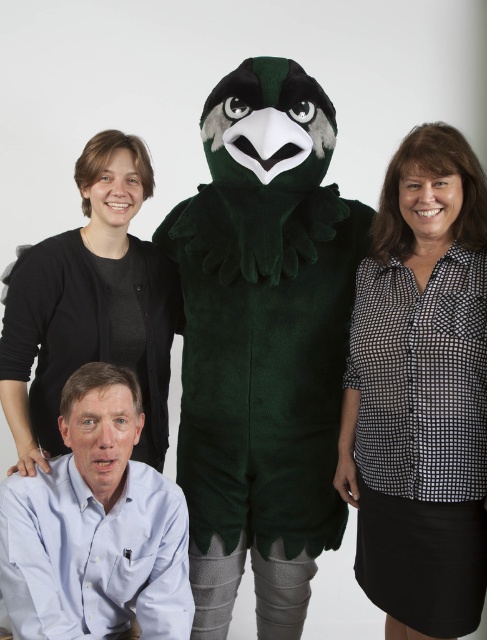
Question: From the image, what is the correct spatial relationship of black checkered shirt at right in relation to light blue shirt at lower left?

Choices:
 (A) right
 (B) left

Answer: (A)

Question: Which of the following is the farthest from the observer?

Choices:
 (A) black soft sweater at upper left
 (B) light blue shirt at lower left

Answer: (A)

Question: Where is black checkered shirt at right located in relation to black soft sweater at upper left in the image?

Choices:
 (A) right
 (B) left

Answer: (A)

Question: Estimate the real-world distances between objects in this image. Which object is closer to the light blue shirt at lower left?

Choices:
 (A) black checkered shirt at right
 (B) black soft sweater at upper left

Answer: (B)

Question: Considering the relative positions of black checkered shirt at right and black soft sweater at upper left in the image provided, where is black checkered shirt at right located with respect to black soft sweater at upper left?

Choices:
 (A) above
 (B) below

Answer: (B)

Question: Which object appears closest to the camera in this image?

Choices:
 (A) black checkered shirt at right
 (B) black soft sweater at upper left
 (C) light blue shirt at lower left

Answer: (C)